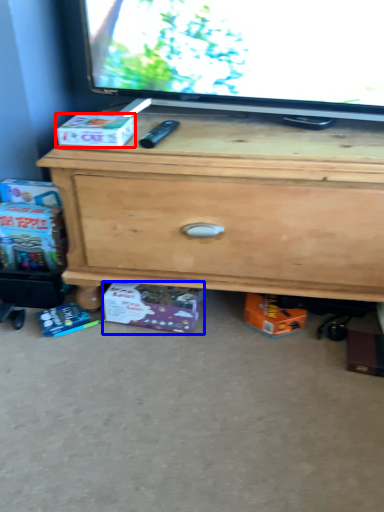
Question: Among these objects, which one is nearest to the camera, box (highlighted by a red box) or box (highlighted by a blue box)?

Choices:
 (A) box
 (B) box

Answer: (A)